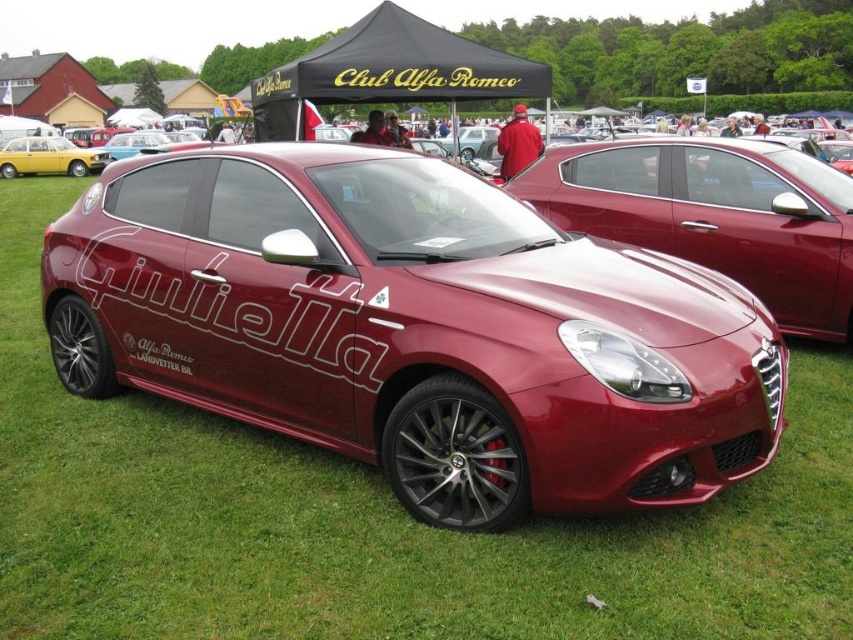
Question: Considering the relative positions of glossy metallic car at center and yellow matte hatchback at left in the image provided, where is glossy metallic car at center located with respect to yellow matte hatchback at left?

Choices:
 (A) above
 (B) below

Answer: (B)

Question: Does glossy metallic car at center appear on the left side of yellow matte hatchback at left?

Choices:
 (A) no
 (B) yes

Answer: (A)

Question: Can you confirm if glossy metallic car at center is positioned to the left of yellow matte hatchback at left?

Choices:
 (A) yes
 (B) no

Answer: (B)

Question: Which of the following is the farthest from the observer?

Choices:
 (A) (15, 172)
 (B) (798, 205)

Answer: (A)